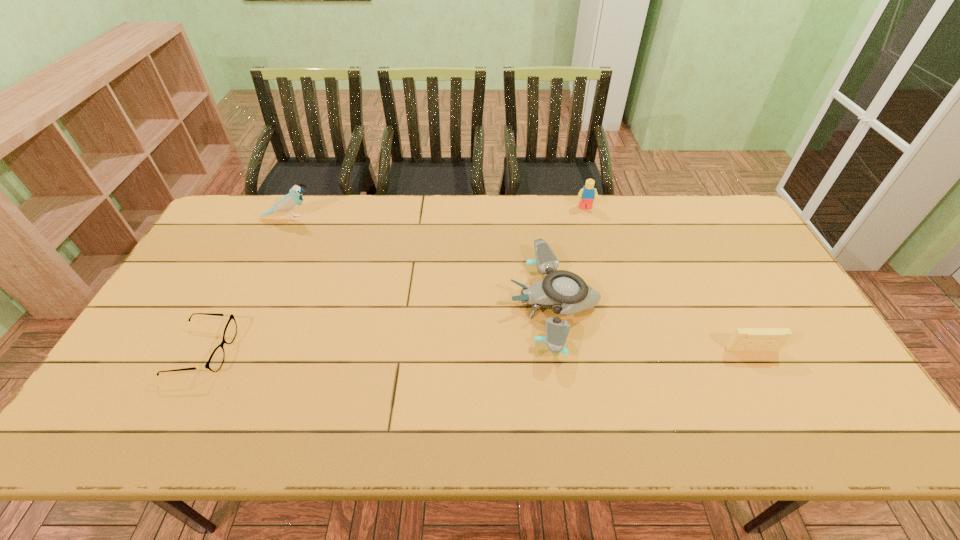
At what (x,y) coordinates should I click in order to perform the action: click on free space that satisfies the following two spatial constraints: 1. at the front of the rightmost object with spools; 2. on the front-facing side of the spectacles. Please return your answer as a coordinate pair (x, y). Image resolution: width=960 pixels, height=540 pixels. Looking at the image, I should click on pos(753,352).